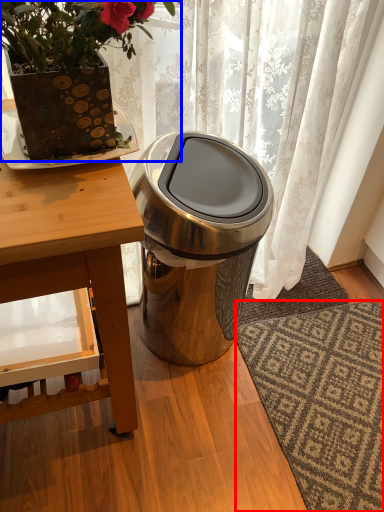
Question: Which object appears closest to the camera in this image, doormat (highlighted by a red box) or houseplant (highlighted by a blue box)?

Choices:
 (A) doormat
 (B) houseplant

Answer: (B)